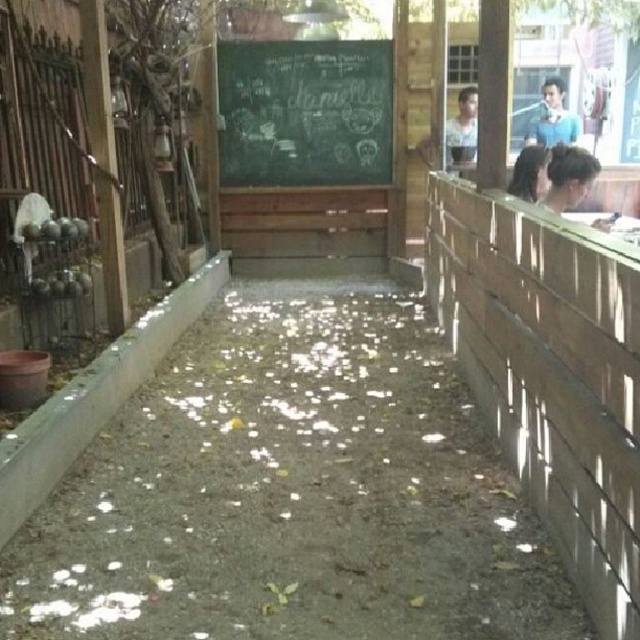
Question: Among these points, which one is nearest to the camera?

Choices:
 (A) (552, 176)
 (B) (480, 330)
 (C) (364, 140)
 (D) (467, 134)

Answer: (B)

Question: Which object is closer to the camera taking this photo?

Choices:
 (A) smooth skin face at upper right
 (B) blue shirt at upper right
 (C) dark brown hair at upper right

Answer: (C)

Question: Is black chalkboard at center smaller than smooth skin face at upper right?

Choices:
 (A) no
 (B) yes

Answer: (A)

Question: Is dark brown hair at upper right bigger than black hair at upper right?

Choices:
 (A) no
 (B) yes

Answer: (A)

Question: Which of the following is the closest to the observer?

Choices:
 (A) wooden fence at right
 (B) smooth skin face at upper right
 (C) blue shirt at upper right

Answer: (A)

Question: Is blue shirt at upper right wider than black hair at upper right?

Choices:
 (A) yes
 (B) no

Answer: (A)